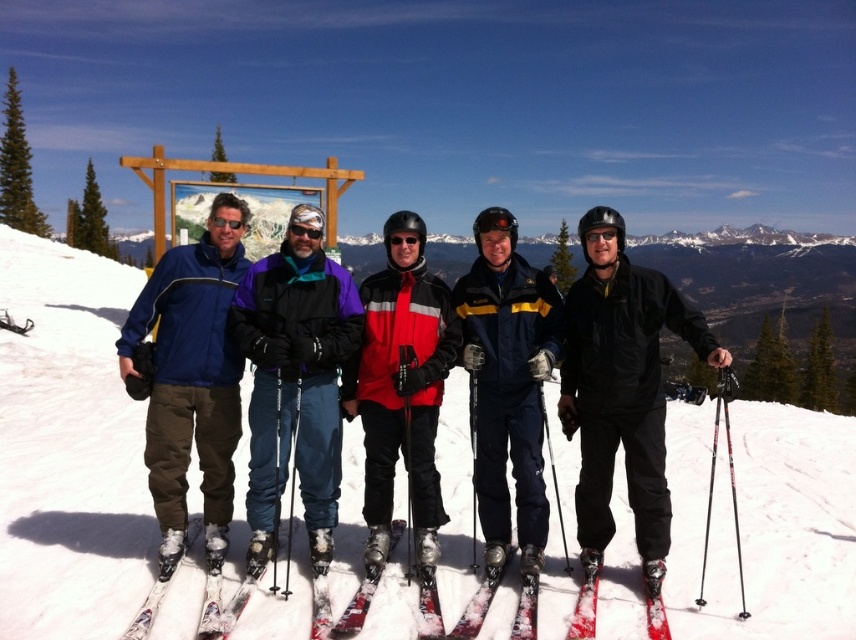
I want to click on red matte jacket at center, so click(x=401, y=387).

Does red matte jacket at center have a larger size compared to shiny metallic skis at center?

Indeed, red matte jacket at center has a larger size compared to shiny metallic skis at center.

Describe the element at coordinates (401, 387) in the screenshot. I see `red matte jacket at center` at that location.

This screenshot has width=856, height=640. What are the coordinates of `red matte jacket at center` in the screenshot? It's located at (401, 387).

Which is behind, point (357, 624) or point (302, 230)?

Positioned behind is point (302, 230).

What do you see at coordinates (355, 611) in the screenshot? This screenshot has height=640, width=856. I see `shiny metallic skis at center` at bounding box center [355, 611].

The height and width of the screenshot is (640, 856). I want to click on shiny metallic skis at center, so click(355, 611).

Which is more to the right, red matte ski at lower right or shiny metallic skis at center?

red matte ski at lower right is more to the right.

Who is higher up, red matte ski at lower right or shiny metallic skis at center?

Positioned higher is red matte ski at lower right.

Locate an element on the screen. red matte ski at lower right is located at coordinates (586, 598).